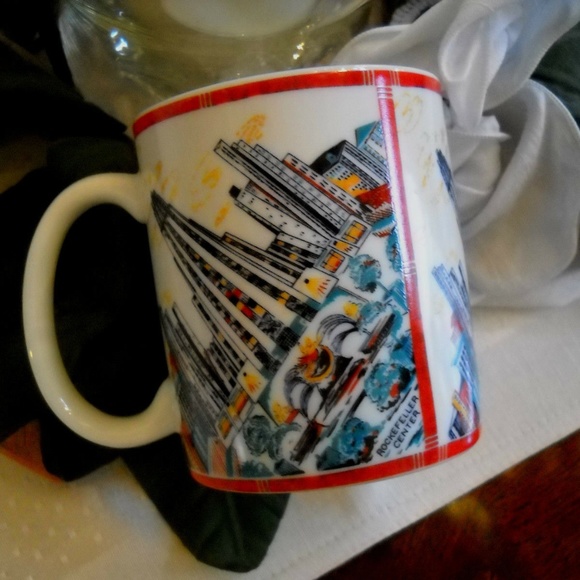
At what (x,y) coordinates should I click in order to perform the action: click on plastic cover. Please return your answer as a coordinate pair (x, y). Image resolution: width=580 pixels, height=580 pixels. Looking at the image, I should click on (126, 52).